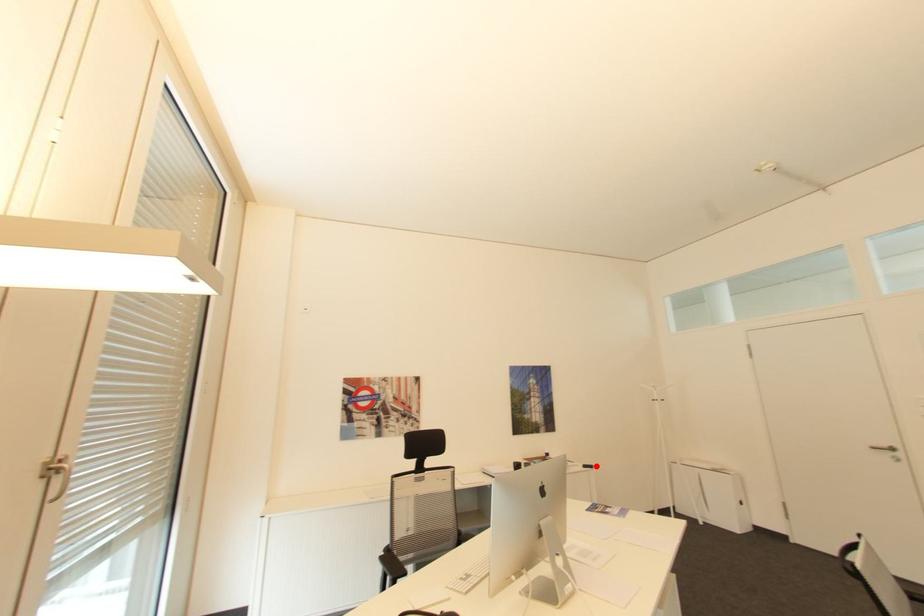
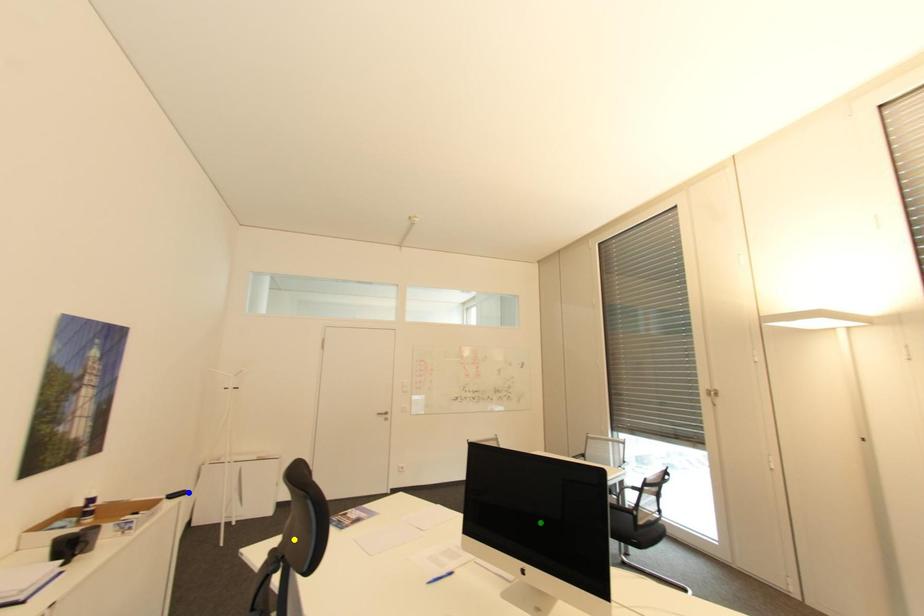
Question: I am providing you with two images of the same scene from different viewpoints. A red point is marked on the first image. You are given multiple points on the second image. Which point in image 2 represents the same 3d spot as the red point in image 1?

Choices:
 (A) yellow point
 (B) green point
 (C) blue point

Answer: (C)